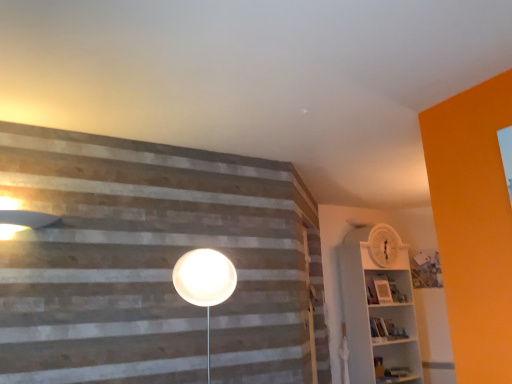
Measure the distance between white matte barn door at center and camera.

The depth of white matte barn door at center is 3.21 meters.

This screenshot has width=512, height=384. Find the location of `matte white lampshade at upper left`. matte white lampshade at upper left is located at coordinates (22, 221).

Looking at this image, is white matte barn door at center positioned before matte white lampshade at upper left?

No, it is not.

Is white matte barn door at center placed right next to matte white lampshade at upper left?

No, white matte barn door at center is not touching matte white lampshade at upper left.

Find the location of a particular element. This screenshot has height=384, width=512. barn door lying behind the matte white lampshade at upper left is located at coordinates (317, 306).

From the image's perspective, which object appears higher, white matte barn door at center or matte white lampshade at upper left?

matte white lampshade at upper left appears higher in the image.

From the image's perspective, relative to white plastic shelf at right, is matte white lampshade at upper left above or below?

matte white lampshade at upper left is situated higher than white plastic shelf at right in the image.

Can you confirm if matte white lampshade at upper left is bigger than white plastic shelf at right?

Actually, matte white lampshade at upper left might be smaller than white plastic shelf at right.

Is the surface of matte white lampshade at upper left in direct contact with white plastic shelf at right?

No, matte white lampshade at upper left is not touching white plastic shelf at right.

From a real-world perspective, which is physically above, matte white lampshade at upper left or white plastic shelf at right?

matte white lampshade at upper left, from a real-world perspective.

Would you say white matte barn door at center is part of matte white lampshade at upper left's contents?

Actually, white matte barn door at center is outside matte white lampshade at upper left.

From a real-world perspective, who is located lower, matte white lampshade at upper left or white matte barn door at center?

white matte barn door at center, from a real-world perspective.

Is matte white lampshade at upper left at the right side of white matte barn door at center?

In fact, matte white lampshade at upper left is to the left of white matte barn door at center.

Considering the relative positions of matte white lampshade at upper left and white matte barn door at center in the image provided, is matte white lampshade at upper left behind white matte barn door at center?

That is False.

Who is shorter, white plastic shelf at right or matte white lampshade at upper left?

Standing shorter between the two is matte white lampshade at upper left.

Considering the relative positions of white plastic shelf at right and matte white lampshade at upper left in the image provided, is white plastic shelf at right to the left of matte white lampshade at upper left from the viewer's perspective?

Incorrect, white plastic shelf at right is not on the left side of matte white lampshade at upper left.

Is white plastic shelf at right far away from matte white lampshade at upper left?

Yes.

Image resolution: width=512 pixels, height=384 pixels. In order to click on shelf lying behind the matte white lampshade at upper left in this screenshot , I will do `click(379, 317)`.

From the image's perspective, is white plastic shelf at right on white matte barn door at center?

Incorrect, from the image's perspective, white plastic shelf at right is lower than white matte barn door at center.

Which of these two, white plastic shelf at right or white matte barn door at center, is thinner?

Thinner between the two is white matte barn door at center.

Would you say white plastic shelf at right contains white matte barn door at center?

Actually, white matte barn door at center is outside white plastic shelf at right.

Is white plastic shelf at right oriented towards white matte barn door at center?

No, white plastic shelf at right is not turned towards white matte barn door at center.

From the image's perspective, is white matte barn door at center above or below white plastic shelf at right?

white matte barn door at center is above white plastic shelf at right.

In the scene shown: Can white plastic shelf at right be found inside white matte barn door at center?

No, white plastic shelf at right is not inside white matte barn door at center.

The height and width of the screenshot is (384, 512). Find the location of `barn door above the white plastic shelf at right (from the image's perspective)`. barn door above the white plastic shelf at right (from the image's perspective) is located at coordinates (317, 306).

From a real-world perspective, is white matte barn door at center located beneath white plastic shelf at right?

No, from a real-world perspective, white matte barn door at center is not beneath white plastic shelf at right.

This screenshot has width=512, height=384. In the image, there is a white matte barn door at center. In order to click on lamp above it (from the image's perspective) in this screenshot , I will do (x=22, y=221).

Image resolution: width=512 pixels, height=384 pixels. I want to click on shelf beneath the matte white lampshade at upper left (from a real-world perspective), so click(x=379, y=317).

From the image, which object appears to be farther from matte white lampshade at upper left, white plastic shelf at right or white matte barn door at center?

white plastic shelf at right lies further to matte white lampshade at upper left than the other object.

When comparing their distances from white plastic shelf at right, does white matte barn door at center or matte white lampshade at upper left seem further?

matte white lampshade at upper left lies further to white plastic shelf at right than the other object.

Which object lies further to the anchor point white matte barn door at center, matte white lampshade at upper left or white plastic shelf at right?

Based on the image, matte white lampshade at upper left appears to be further to white matte barn door at center.

From the picture: When comparing their distances from white plastic shelf at right, does matte white lampshade at upper left or white matte barn door at center seem closer?

Based on the image, white matte barn door at center appears to be nearer to white plastic shelf at right.

Based on their spatial positions, is white plastic shelf at right or matte white lampshade at upper left further from white matte barn door at center?

Among the two, matte white lampshade at upper left is located further to white matte barn door at center.

Looking at the image, which one is located further to matte white lampshade at upper left, white matte barn door at center or white plastic shelf at right?

white plastic shelf at right is positioned further to the anchor matte white lampshade at upper left.

Where is `barn door between matte white lampshade at upper left and white plastic shelf at right`? barn door between matte white lampshade at upper left and white plastic shelf at right is located at coordinates (317, 306).